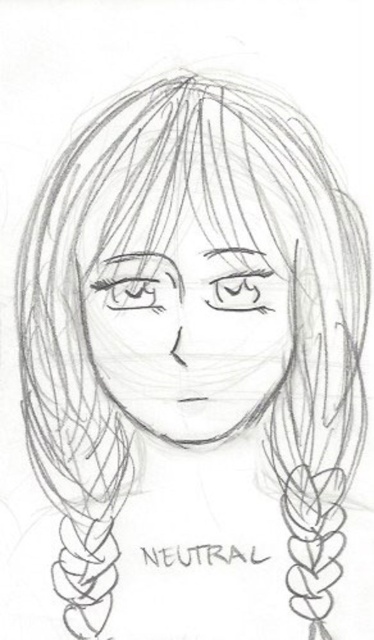
Based on the photo, looking at the pencil sketch, which object is taller between the pencil sketch face at center and the pencil sketch eye at center?

The pencil sketch face at center is taller than the pencil sketch eye at center.

You are an artist examining a pencil sketch of a face. You notice two points marked on the image at coordinates point (224, 304) and point (146, 284). If you were to touch these points with your finger, which one would feel closer to your hand?

Point (146, 284) is closer to the camera than point (224, 304), so touching point (146, 284) would feel closer to your hand.

You are an art student analyzing the pencil sketch face at center and the matte pencil eye at upper center in the image. Which object is positioned closer to the viewer?

The pencil sketch face at center is closer to the viewer than the matte pencil eye at upper center.